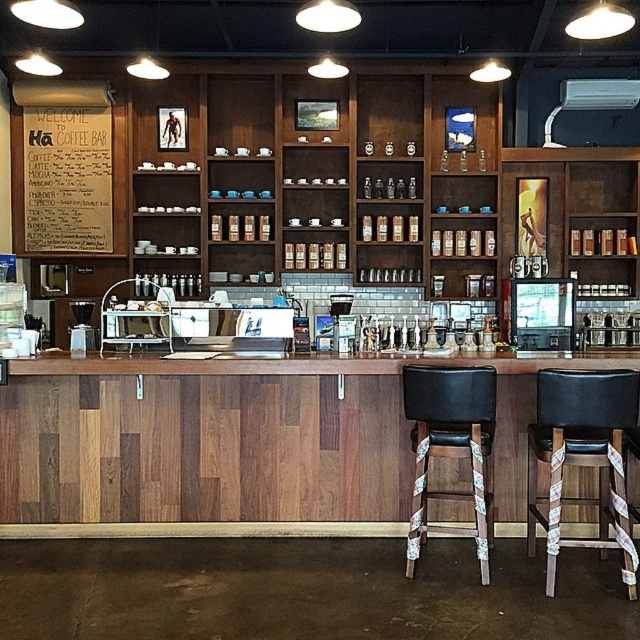
Who is shorter, black leather stool at right or black leather stool at center?

With less height is black leather stool at right.

Looking at this image, is the position of black leather stool at right less distant than that of black leather stool at center?

Yes, black leather stool at right is in front of black leather stool at center.

Between point (556, 378) and point (483, 557), which one is positioned behind?

The point (483, 557) is more distant.

Where is `black leather stool at right`? This screenshot has width=640, height=640. black leather stool at right is located at coordinates (582, 458).

Is point (45, 125) closer to viewer compared to point (486, 516)?

That is False.

Does wooden menu board at upper left have a greater height compared to black leather stool at center?

Yes, wooden menu board at upper left is taller than black leather stool at center.

This screenshot has height=640, width=640. Identify the location of wooden menu board at upper left. (67, 164).

Locate an element on the screen. Image resolution: width=640 pixels, height=640 pixels. wooden menu board at upper left is located at coordinates (67, 164).

Does black leather stool at right have a larger size compared to wooden menu board at upper left?

Indeed, black leather stool at right has a larger size compared to wooden menu board at upper left.

Is black leather stool at right taller than wooden menu board at upper left?

In fact, black leather stool at right may be shorter than wooden menu board at upper left.

From the picture: Measure the distance between black leather stool at right and camera.

A distance of 3.48 meters exists between black leather stool at right and camera.

Locate an element on the screen. The width and height of the screenshot is (640, 640). black leather stool at right is located at coordinates (582, 458).